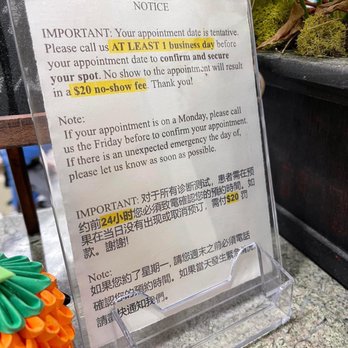
At what (x,y) coordinates should I click in order to perform the action: click on wall. Please return your answer as a coordinate pair (x, y). Image resolution: width=348 pixels, height=348 pixels. Looking at the image, I should click on (295, 110).